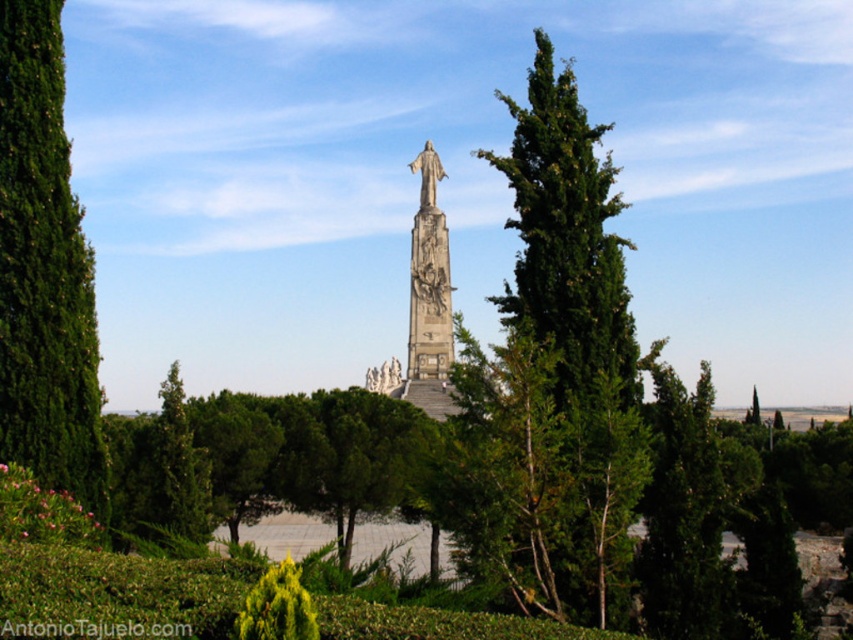
Question: Which point is farther to the camera?

Choices:
 (A) (3, 417)
 (B) (450, 298)

Answer: (B)

Question: Which point appears farthest from the camera in this image?

Choices:
 (A) (15, 460)
 (B) (440, 355)

Answer: (B)

Question: Can you confirm if green textured tree at left is wider than stone statue at center?

Choices:
 (A) yes
 (B) no

Answer: (A)

Question: Can you confirm if green textured tree at left is smaller than stone statue at center?

Choices:
 (A) no
 (B) yes

Answer: (A)

Question: Which object appears closest to the camera in this image?

Choices:
 (A) stone statue at center
 (B) green textured tree at left

Answer: (B)

Question: Does green textured tree at left appear on the right side of stone statue at center?

Choices:
 (A) yes
 (B) no

Answer: (B)